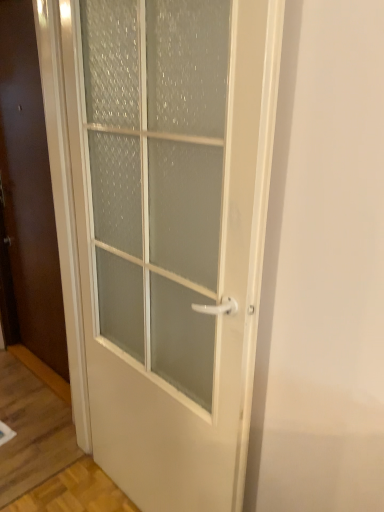
Question: Does white glossy door at center, the first door from the back, appear on the right side of white frosted glass door at center, the first door from the front?

Choices:
 (A) no
 (B) yes

Answer: (A)

Question: Considering the relative sizes of white glossy door at center, which is the 2th door in right-to-left order, and white frosted glass door at center, which is counted as the second door, starting from the left, in the image provided, is white glossy door at center, which is the 2th door in right-to-left order, taller than white frosted glass door at center, which is counted as the second door, starting from the left,?

Choices:
 (A) yes
 (B) no

Answer: (A)

Question: From a real-world perspective, is white glossy door at center, the first door from the back, on white frosted glass door at center, which is the first door from right to left?

Choices:
 (A) yes
 (B) no

Answer: (A)

Question: Is white glossy door at center, which is the 2th door in right-to-left order, wider than white frosted glass door at center, which is the first door from right to left?

Choices:
 (A) yes
 (B) no

Answer: (B)

Question: Does white glossy door at center, which is counted as the first door, starting from the left, appear on the left side of white frosted glass door at center, which is the first door from right to left?

Choices:
 (A) yes
 (B) no

Answer: (A)

Question: Is the position of white glossy door at center, the first door from the back, less distant than that of white frosted glass door at center, which is the first door from right to left?

Choices:
 (A) no
 (B) yes

Answer: (A)

Question: Would you say white frosted glass door at center, acting as the second door starting from the back, contains white glossy door at center, the first door from the back?

Choices:
 (A) yes
 (B) no

Answer: (B)

Question: Can you confirm if white frosted glass door at center, which is the first door from right to left, is shorter than white glossy door at center, positioned as the second door in front-to-back order?

Choices:
 (A) yes
 (B) no

Answer: (A)

Question: From the image's perspective, is white frosted glass door at center, which is counted as the second door, starting from the left, below white glossy door at center, which is the 2th door in right-to-left order?

Choices:
 (A) yes
 (B) no

Answer: (A)

Question: Can you confirm if white frosted glass door at center, which is counted as the second door, starting from the left, is wider than white glossy door at center, which is the 2th door in right-to-left order?

Choices:
 (A) yes
 (B) no

Answer: (A)

Question: Can you confirm if white frosted glass door at center, the first door from the front, is bigger than white glossy door at center, which is counted as the first door, starting from the left?

Choices:
 (A) yes
 (B) no

Answer: (A)

Question: From the image's perspective, is white frosted glass door at center, which is counted as the second door, starting from the left, over white glossy door at center, positioned as the second door in front-to-back order?

Choices:
 (A) no
 (B) yes

Answer: (A)

Question: Relative to white glossy door at center, which is the 2th door in right-to-left order, is white frosted glass door at center, the first door from the front, in front or behind?

Choices:
 (A) behind
 (B) front

Answer: (B)